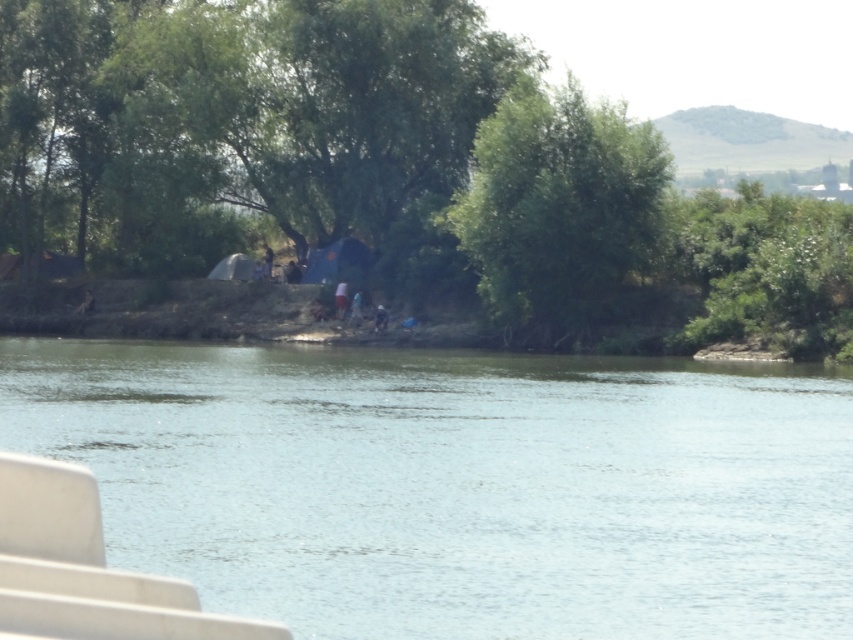
Between green water at center and green leafy tree at upper right, which one has more height?

green leafy tree at upper right

Describe the element at coordinates (457, 484) in the screenshot. I see `green water at center` at that location.

At what (x,y) coordinates should I click in order to perform the action: click on green water at center. Please return your answer as a coordinate pair (x, y). Looking at the image, I should click on (457, 484).

Is point (412, 419) farther from viewer compared to point (604, 140)?

That is False.

Describe the element at coordinates (457, 484) in the screenshot. I see `green water at center` at that location.

What are the coordinates of `green water at center` in the screenshot? It's located at (457, 484).

Measure the distance between point (811, 289) and camera.

Point (811, 289) and camera are 215.07 feet apart.

Does green leafy tree at center lie in front of green leafy tree at upper center?

Yes, it is.

Between point (633, 276) and point (616, 276), which one is positioned in front?

Point (616, 276) is more forward.

The image size is (853, 640). Find the location of `green leafy tree at center`. green leafy tree at center is located at coordinates (408, 172).